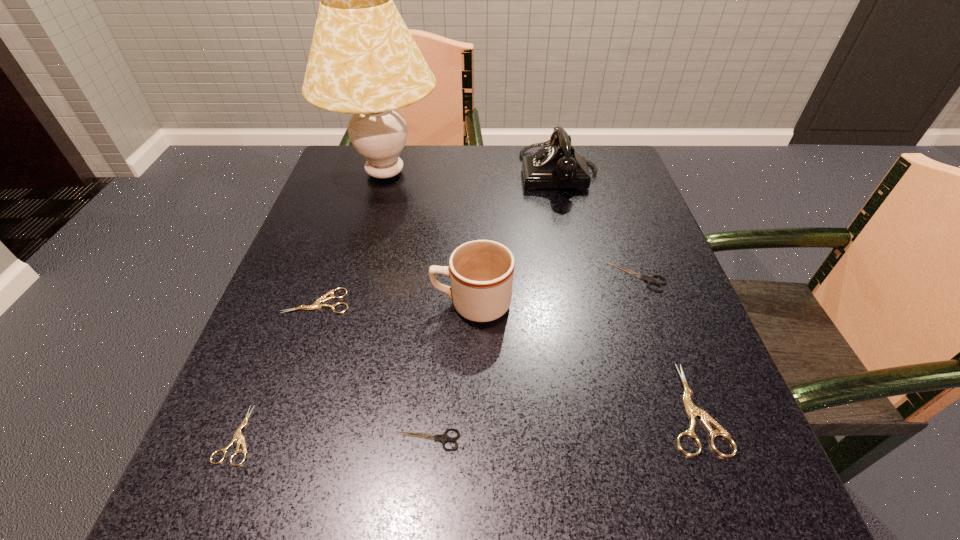
Where is `the shortest object`? The image size is (960, 540). the shortest object is located at coordinates (238, 436).

I want to click on the smallest beige shears, so pyautogui.click(x=238, y=436).

Find the location of a particular element. The width and height of the screenshot is (960, 540). blank space located on the right of the tallest object is located at coordinates coord(588,173).

You are a GUI agent. You are given a task and a screenshot of the screen. Output one action in this format:
    pyautogui.click(x=<x>, y=<y>)
    Task: Click on the free space located 0.400m on the dial of the black telephone
    The height and width of the screenshot is (540, 960).
    Given the screenshot: What is the action you would take?
    pyautogui.click(x=363, y=173)

This screenshot has height=540, width=960. What are the coordinates of `vacant space located 0.390m on the dial of the black telephone` in the screenshot? It's located at (368, 173).

The image size is (960, 540). I want to click on free space located on the dial of the black telephone, so [387, 173].

Where is `vacant space located on the side of the brown mug with the handle`? vacant space located on the side of the brown mug with the handle is located at coordinates (339, 303).

In order to click on free space located 0.170m on the side of the brown mug with the handle in this screenshot , I will do `click(339, 303)`.

I want to click on vacant region located on the back of the farther black shears, so click(603, 181).

This screenshot has height=540, width=960. Find the location of `free space located 0.400m on the back of the rightmost beige shears`. free space located 0.400m on the back of the rightmost beige shears is located at coordinates (620, 215).